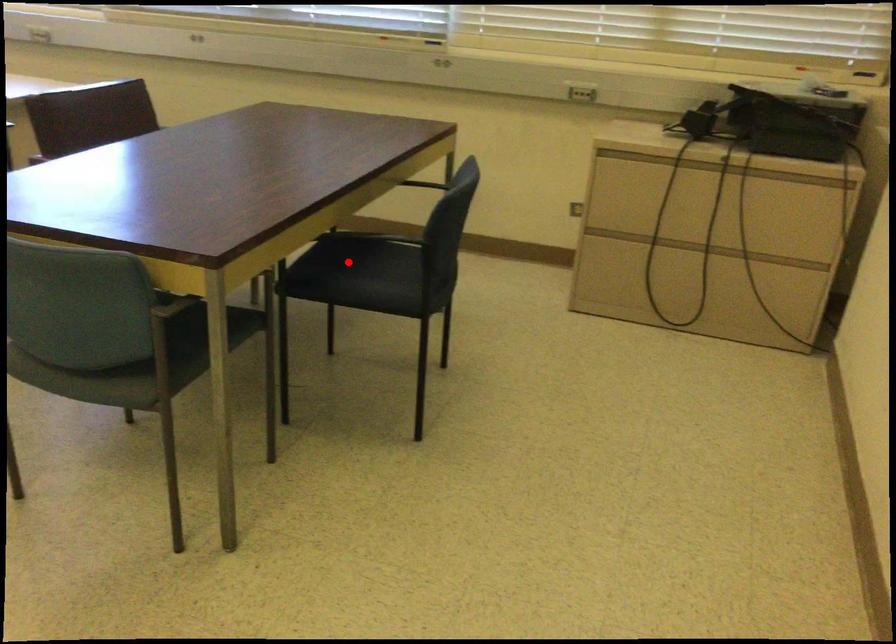
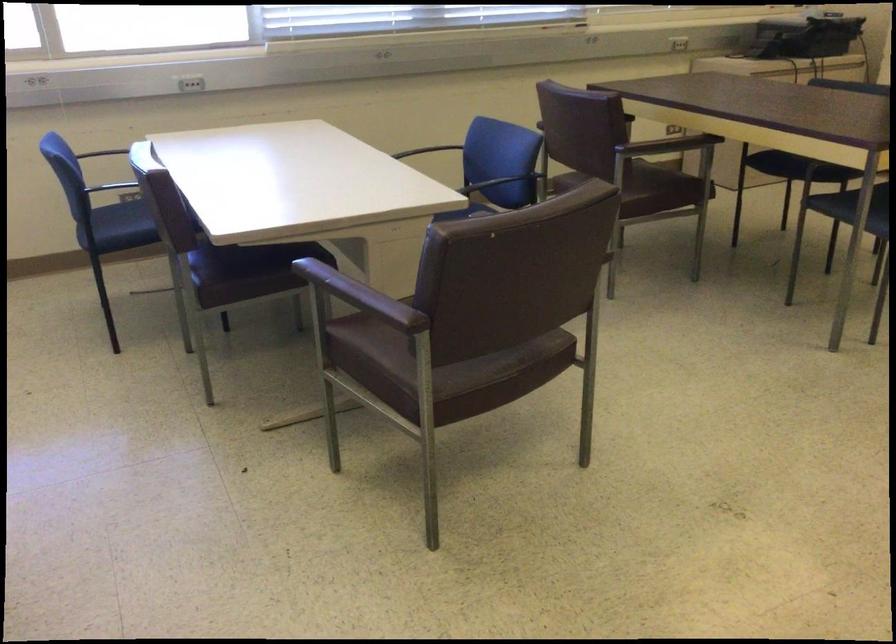
Question: I am providing you with two images of the same scene from different viewpoints. A red point is marked on the first image. At the location where the point appears in image 1, is it still visible in image 2?

Choices:
 (A) Yes
 (B) No

Answer: (B)